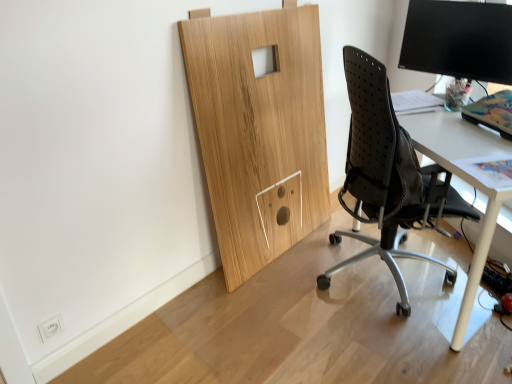
This screenshot has height=384, width=512. What do you see at coordinates (465, 181) in the screenshot?
I see `white glossy desk at right` at bounding box center [465, 181].

Based on the photo, measure the distance between black mesh chair at right and camera.

A: They are 4.85 feet apart.

Describe the element at coordinates (388, 176) in the screenshot. The height and width of the screenshot is (384, 512). I see `black mesh chair at right` at that location.

Locate an element on the screen. The width and height of the screenshot is (512, 384). white glossy desk at right is located at coordinates (465, 181).

Is black glossy monitor at upper right positioned before black mesh chair at right?

No, black glossy monitor at upper right is further to the viewer.

Based on the photo, is black glossy monitor at upper right wider than black mesh chair at right?

Incorrect, the width of black glossy monitor at upper right does not surpass that of black mesh chair at right.

Between black glossy monitor at upper right and black mesh chair at right, which one has smaller size?

black glossy monitor at upper right is smaller.

Would you consider black glossy monitor at upper right to be distant from black mesh chair at right?

No, black glossy monitor at upper right is in close proximity to black mesh chair at right.

Find the location of a particular element. The height and width of the screenshot is (384, 512). desk located on the left of black glossy monitor at upper right is located at coordinates (465, 181).

Between white glossy desk at right and black glossy monitor at upper right, which one has more height?

With more height is white glossy desk at right.

Between white glossy desk at right and black glossy monitor at upper right, which one appears on the right side from the viewer's perspective?

black glossy monitor at upper right.

Considering the positions of point (464, 297) and point (506, 5), is point (464, 297) closer or farther from the camera than point (506, 5)?

Point (464, 297) is closer to the camera than point (506, 5).

Considering the positions of objects black mesh chair at right and black glossy monitor at upper right in the image provided, who is more to the right, black mesh chair at right or black glossy monitor at upper right?

From the viewer's perspective, black glossy monitor at upper right appears more on the right side.

Considering the relative sizes of black mesh chair at right and black glossy monitor at upper right in the image provided, is black mesh chair at right thinner than black glossy monitor at upper right?

In fact, black mesh chair at right might be wider than black glossy monitor at upper right.

From the image's perspective, is black mesh chair at right located beneath black glossy monitor at upper right?

Yes, from the image's perspective, black mesh chair at right is beneath black glossy monitor at upper right.

Can you see black mesh chair at right touching black glossy monitor at upper right?

black mesh chair at right is not next to black glossy monitor at upper right, and they're not touching.

Can you tell me how much black mesh chair at right and white glossy desk at right differ in facing direction?

The facing directions of black mesh chair at right and white glossy desk at right are 179 degrees apart.

Does black mesh chair at right have a greater width compared to white glossy desk at right?

Yes.

Can you confirm if black mesh chair at right is taller than white glossy desk at right?

Indeed, black mesh chair at right has a greater height compared to white glossy desk at right.

How much distance is there between black glossy monitor at upper right and white glossy desk at right?

The distance of black glossy monitor at upper right from white glossy desk at right is 18.26 inches.

From the image's perspective, is black glossy monitor at upper right located beneath white glossy desk at right?

No.

Considering the relative sizes of black glossy monitor at upper right and white glossy desk at right in the image provided, is black glossy monitor at upper right smaller than white glossy desk at right?

Yes, black glossy monitor at upper right is smaller than white glossy desk at right.

Is black glossy monitor at upper right to the right of white glossy desk at right from the viewer's perspective?

Yes.

Is white glossy desk at right far from black mesh chair at right?

white glossy desk at right is near black mesh chair at right, not far away.

Which of these two, white glossy desk at right or black mesh chair at right, is bigger?

black mesh chair at right is bigger.

Which object is thinner, white glossy desk at right or black mesh chair at right?

Thinner between the two is white glossy desk at right.

Image resolution: width=512 pixels, height=384 pixels. What are the coordinates of `chair on the left of the black glossy monitor at upper right` in the screenshot? It's located at (388, 176).

Locate an element on the screen. desk in front of the black glossy monitor at upper right is located at coordinates (465, 181).

Estimate the real-world distances between objects in this image. Which object is further from black mesh chair at right, white glossy desk at right or black glossy monitor at upper right?

black glossy monitor at upper right is positioned further to the anchor black mesh chair at right.

Considering their positions, is white glossy desk at right positioned closer to black glossy monitor at upper right than black mesh chair at right?

white glossy desk at right is positioned closer to the anchor black glossy monitor at upper right.

Looking at the image, which one is located further to white glossy desk at right, black mesh chair at right or black glossy monitor at upper right?

Among the two, black glossy monitor at upper right is located further to white glossy desk at right.

From the picture: Considering their positions, is black glossy monitor at upper right positioned closer to black mesh chair at right than white glossy desk at right?

white glossy desk at right lies closer to black mesh chair at right than the other object.

Looking at the image, which one is located further to white glossy desk at right, black glossy monitor at upper right or black mesh chair at right?

black glossy monitor at upper right is positioned further to the anchor white glossy desk at right.

When comparing their distances from black glossy monitor at upper right, does black mesh chair at right or white glossy desk at right seem closer?

white glossy desk at right lies closer to black glossy monitor at upper right than the other object.

The height and width of the screenshot is (384, 512). In order to click on chair between black glossy monitor at upper right and white glossy desk at right vertically in this screenshot , I will do `click(388, 176)`.